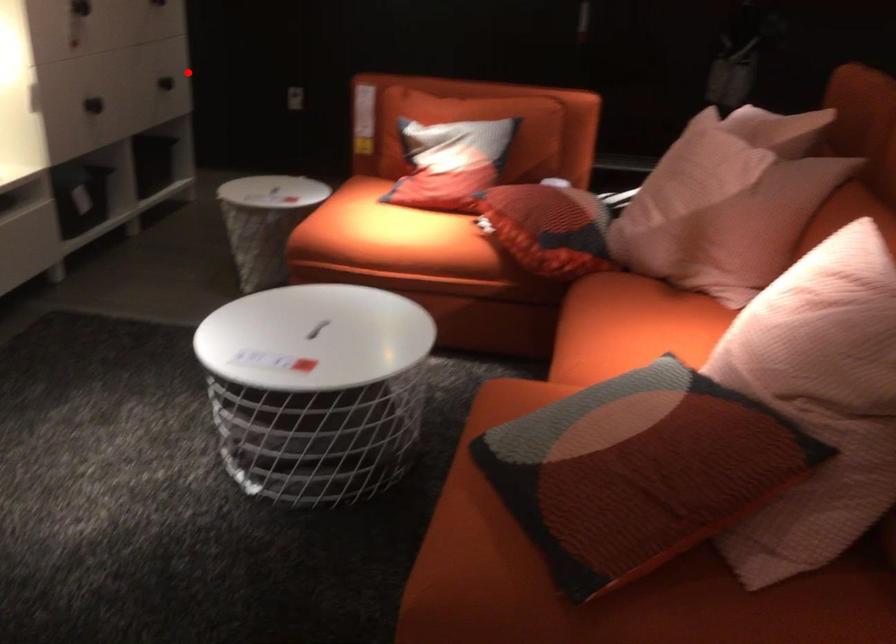
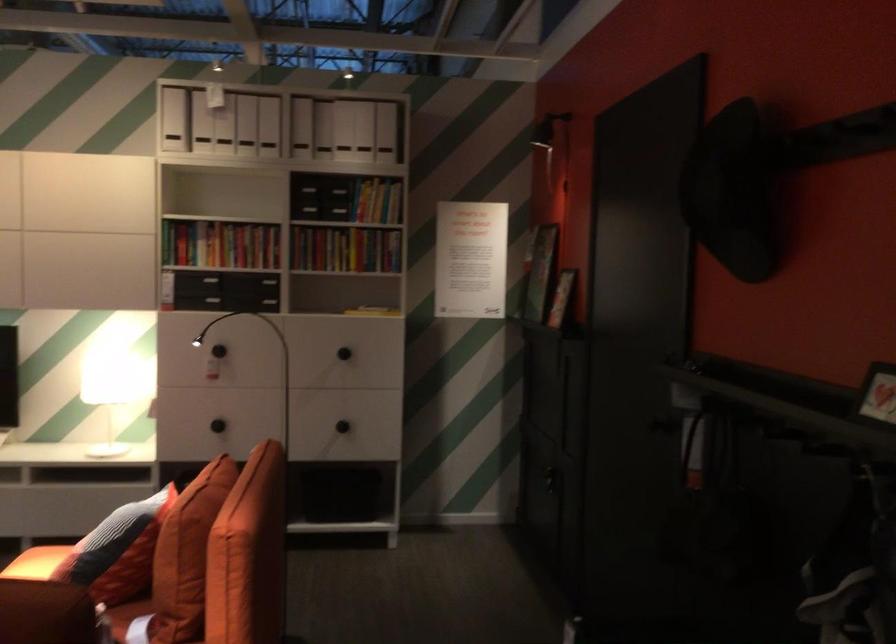
Find the pixel in the second image that matches the highlighted location in the first image.

(341, 426)